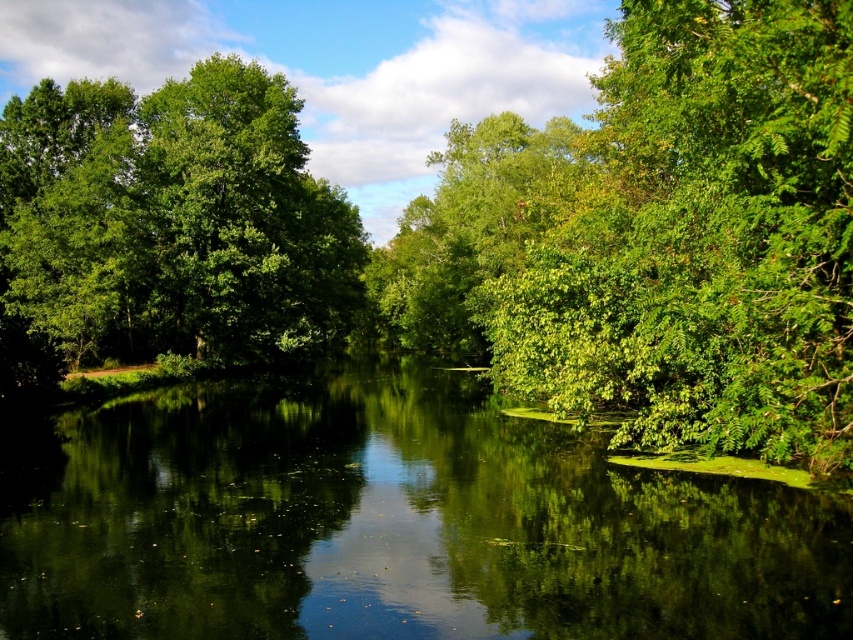
You are standing at the edge of the river and want to walk towards the green leafy forest at center and the green reflective water at center. Which one will you reach first?

You will reach the green leafy forest at center first because it is closer to you than the green reflective water at center.

Based on the scene description, if you are standing at the position of the green leafy tree at left, which direction would the green leafy forest at center be in relative to your position?

The green leafy forest at center is to the right of the green leafy tree at left, so if you are standing at the green leafy tree at left, the green leafy forest at center would be to your right side.